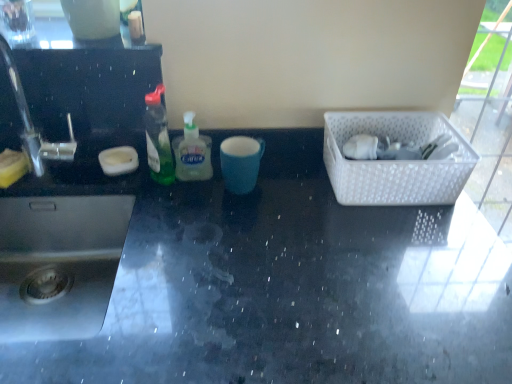
The image size is (512, 384). I want to click on vacant space to the left of white plastic basket at right, so click(x=285, y=195).